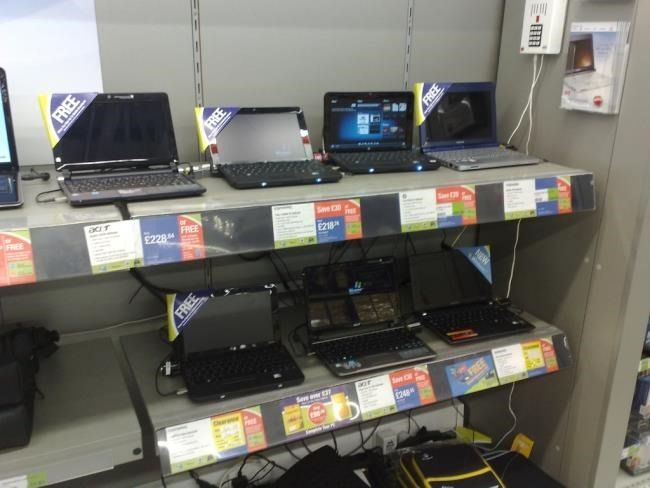
Locate an element on the screen. black computer/ electrical cable is located at coordinates (276, 271).